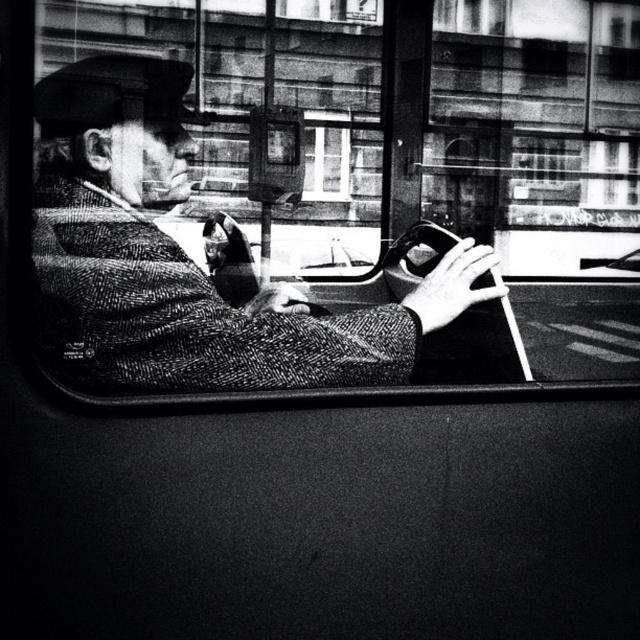
Does herringbone wool coat at center appear on the left side of transparent glass window at center?

Indeed, herringbone wool coat at center is positioned on the left side of transparent glass window at center.

Does herringbone wool coat at center lie in front of transparent glass window at center?

Yes, it is in front of transparent glass window at center.

Find the location of a particular element. herringbone wool coat at center is located at coordinates (186, 260).